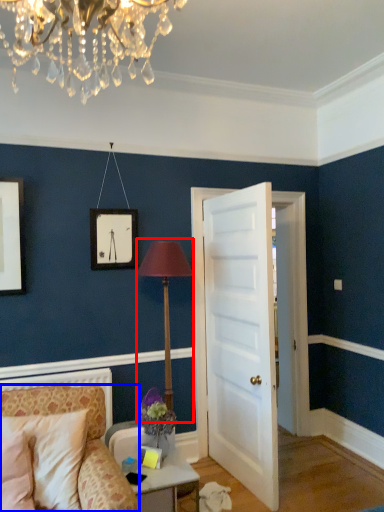
Question: Which object is further to the camera taking this photo, table lamp (highlighted by a red box) or chair (highlighted by a blue box)?

Choices:
 (A) table lamp
 (B) chair

Answer: (A)